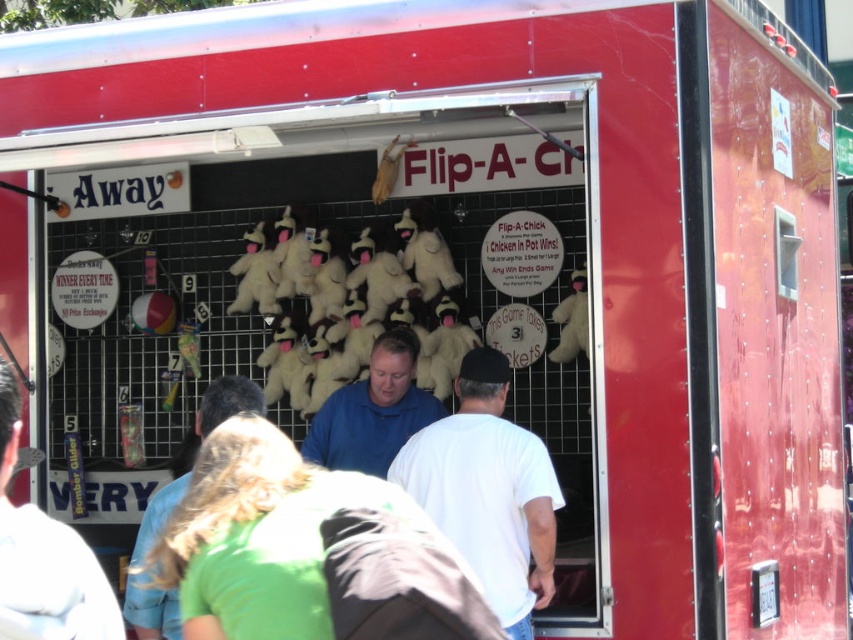
You are a participant at the Flip A Chick game booth. You see a white matte shirt at center and a blue shirt at center. Which shirt is more to the right?

The white matte shirt at center is positioned on the right side of blue shirt at center, so the white matte shirt at center is more to the right.